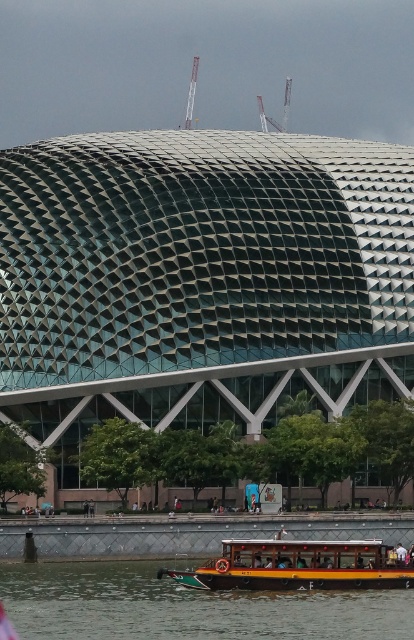
Question: Can you confirm if green wooden boat at lower center is smaller than wooden polished boat at lower center?

Choices:
 (A) yes
 (B) no

Answer: (A)

Question: Which object is closer to the camera taking this photo?

Choices:
 (A) green wooden boat at lower center
 (B) wooden polished boat at lower center

Answer: (A)

Question: Is green wooden boat at lower center positioned behind wooden polished boat at lower center?

Choices:
 (A) no
 (B) yes

Answer: (A)

Question: Is green wooden boat at lower center to the right of wooden polished boat at lower center from the viewer's perspective?

Choices:
 (A) yes
 (B) no

Answer: (B)

Question: Which of the following is the farthest from the observer?

Choices:
 (A) (267, 554)
 (B) (343, 609)

Answer: (A)